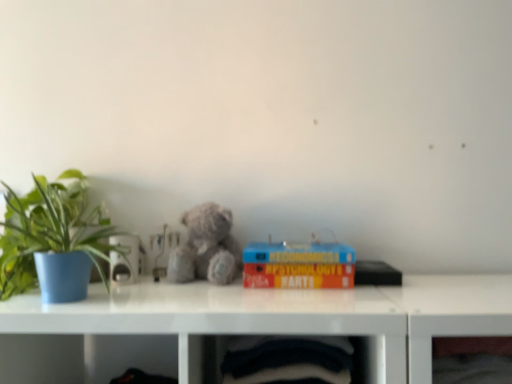
Question: Visually, is velvet-like black fabric at lower center, which is the second shelf in right-to-left order, positioned to the left or to the right of hardcover book at center?

Choices:
 (A) right
 (B) left

Answer: (B)

Question: Considering the positions of velvet-like black fabric at lower center, which is the first shelf in left-to-right order, and hardcover book at center in the image, is velvet-like black fabric at lower center, which is the first shelf in left-to-right order, taller or shorter than hardcover book at center?

Choices:
 (A) tall
 (B) short

Answer: (A)

Question: Estimate the real-world distances between objects in this image. Which object is closer to the transparent glass frame at lower right, the 1th shelf when ordered from right to left?

Choices:
 (A) velvet-like black fabric at lower center, which is the second shelf in right-to-left order
 (B) fuzzy gray teddy bear at center
 (C) hardcover book at center
 (D) green matte plant at left

Answer: (A)

Question: Based on their relative distances, which object is farther from the green matte plant at left?

Choices:
 (A) hardcover book at center
 (B) velvet-like black fabric at lower center, which is the first shelf in left-to-right order
 (C) fuzzy gray teddy bear at center
 (D) transparent glass frame at lower right, which is the second shelf in left-to-right order

Answer: (D)